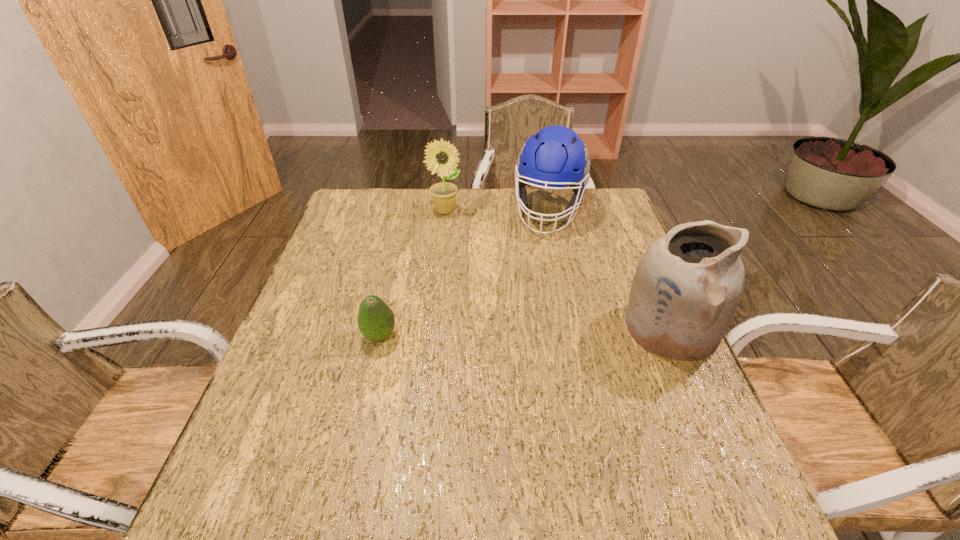
Locate an element on the screen. This screenshot has width=960, height=540. free space located on the face of the third object from right to left is located at coordinates (482, 251).

The image size is (960, 540). Identify the location of vacant point located 0.210m on the face of the third object from right to left. (483, 253).

You are a GUI agent. You are given a task and a screenshot of the screen. Output one action in this format:
    pyautogui.click(x=<x>, y=<y>)
    Task: Click on the free region located on the face of the third object from right to left
    This screenshot has height=540, width=960.
    Given the screenshot: What is the action you would take?
    pyautogui.click(x=467, y=234)

Identify the location of football helmet present at the far edge. The image size is (960, 540). (555, 157).

You are a GUI agent. You are given a task and a screenshot of the screen. Output one action in this format:
    pyautogui.click(x=<x>, y=<y>)
    Task: Click on the sunflower that is at the far edge
    The height and width of the screenshot is (540, 960).
    Given the screenshot: What is the action you would take?
    pyautogui.click(x=443, y=195)

At what (x,y) coordinates should I click in order to perform the action: click on pottery located in the right edge section of the desktop. Please return your answer as a coordinate pair (x, y). The height and width of the screenshot is (540, 960). Looking at the image, I should click on (686, 289).

This screenshot has height=540, width=960. I want to click on football helmet at the right edge, so click(x=555, y=157).

Locate an element on the screen. The height and width of the screenshot is (540, 960). object at the far right corner is located at coordinates (555, 157).

This screenshot has height=540, width=960. In the image, there is a desktop. Identify the location of free space at the far edge. (397, 194).

You are a GUI agent. You are given a task and a screenshot of the screen. Output one action in this format:
    pyautogui.click(x=<x>, y=<y>)
    Task: Click on the free location at the near edge of the desktop
    The width and height of the screenshot is (960, 540).
    Given the screenshot: What is the action you would take?
    pyautogui.click(x=424, y=453)